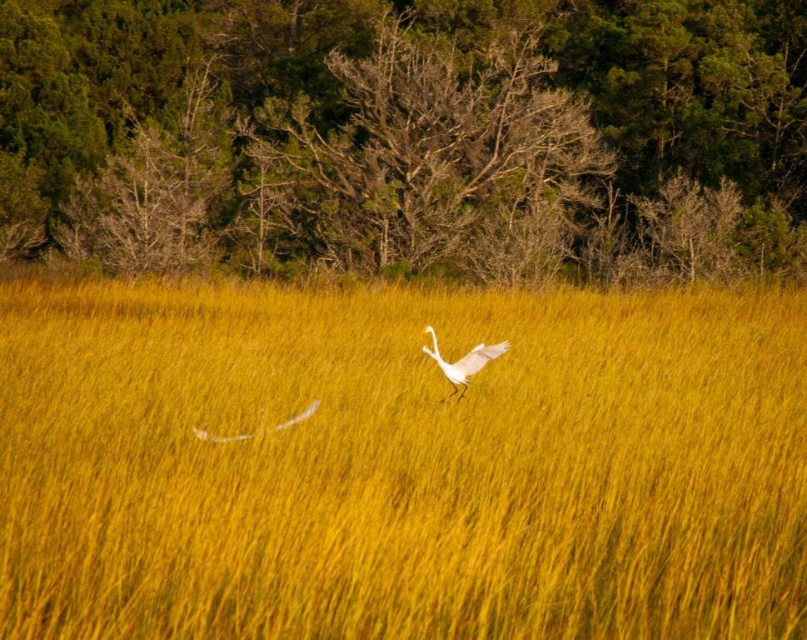
You are standing in the field and see the yellow grass at center and the white matte bird at center. Which object is positioned more to the left from your perspective?

The yellow grass at center is positioned to the left of the white matte bird at center, so the yellow grass at center is more to the left.

You are a photographer trying to capture the white feather at center and the yellow grass at center in the same frame. Which object will appear larger in the photo?

The yellow grass at center will appear larger in the photo because it is bigger than the white feather at center.